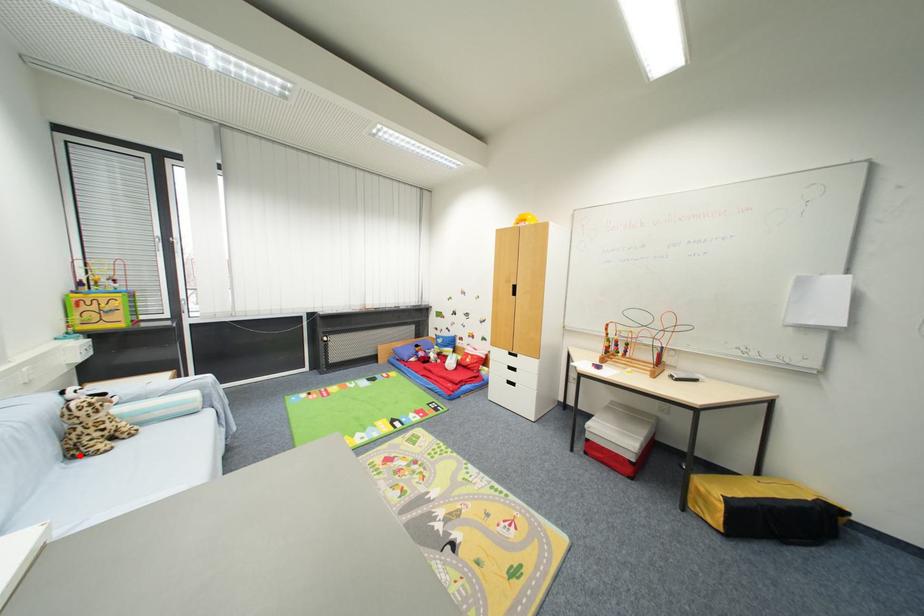
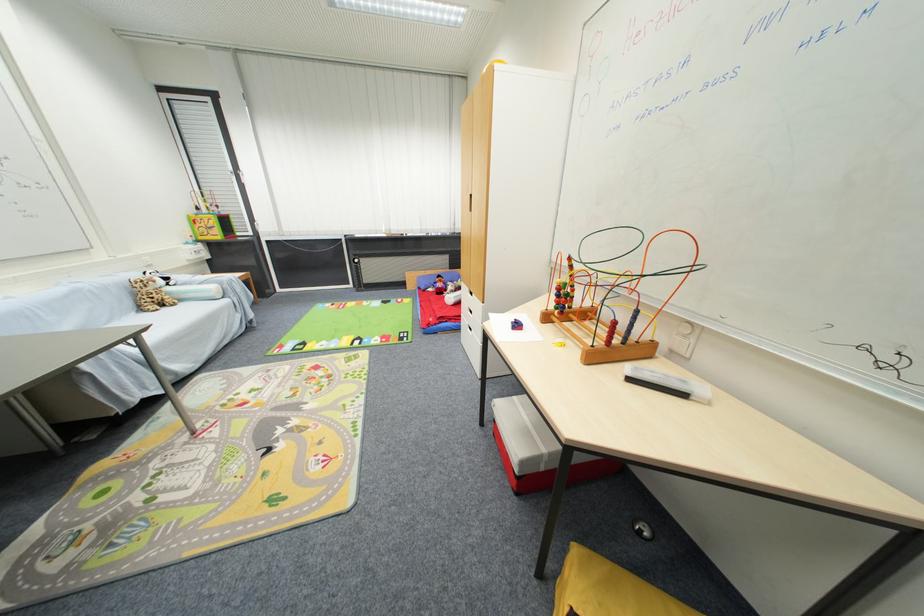
Question: I am providing you with two images of the same scene from different viewpoints. Given a red point in image1, look at the same physical point in image2. Is it:

Choices:
 (A) Closer to the viewpoint
 (B) Farther from the viewpoint

Answer: (A)